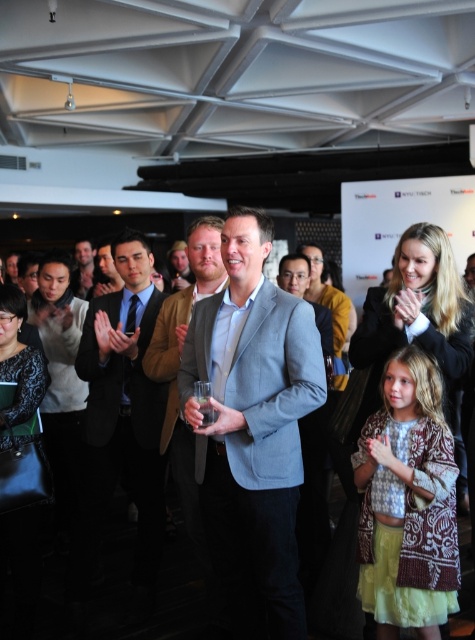
Question: Which of the following is the farthest from the observer?

Choices:
 (A) (300, 378)
 (B) (201, 276)
 (C) (84, 262)

Answer: (C)

Question: Is the position of light gray suit at center less distant than that of light brown leather jacket at center?

Choices:
 (A) yes
 (B) no

Answer: (A)

Question: Does light gray suit at center have a smaller size compared to matte black suit at center?

Choices:
 (A) yes
 (B) no

Answer: (B)

Question: Estimate the real-world distances between objects in this image. Which object is closer to the light brown leather jacket at center?

Choices:
 (A) black satin business suit at center
 (B) matte black suit at center
 (C) light gray suit at center

Answer: (A)

Question: Among these points, which one is farthest from the camera?

Choices:
 (A) (145, 369)
 (B) (304, 616)
 (C) (149, 412)
 (D) (89, 244)

Answer: (D)

Question: Is black satin business suit at center below matte black suit at center?

Choices:
 (A) yes
 (B) no

Answer: (A)